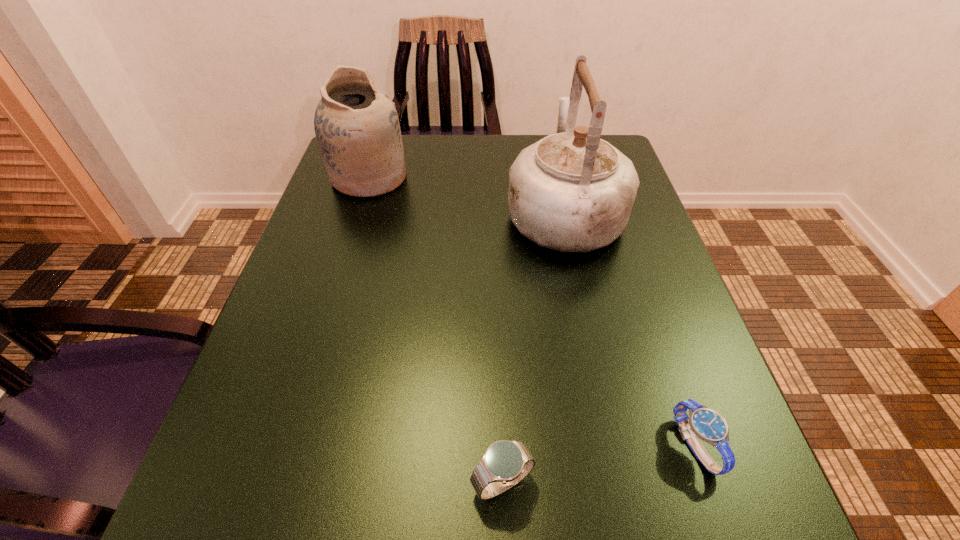
Where is `vacant space in between the kettle and the taller watch`? This screenshot has height=540, width=960. vacant space in between the kettle and the taller watch is located at coordinates (533, 347).

This screenshot has width=960, height=540. Identify the location of vacant point located between the taller watch and the leftmost object. (436, 330).

Identify the location of vacant area that lies between the taller watch and the tallest object. (533, 347).

Where is `free point between the shorter watch and the leftmost object`? This screenshot has width=960, height=540. free point between the shorter watch and the leftmost object is located at coordinates (532, 312).

The height and width of the screenshot is (540, 960). Identify the location of free space between the shorter watch and the taller watch. (598, 464).

Image resolution: width=960 pixels, height=540 pixels. Find the location of `free space that is in between the left watch and the pottery`. free space that is in between the left watch and the pottery is located at coordinates (436, 330).

You are a GUI agent. You are given a task and a screenshot of the screen. Output one action in this format:
    pyautogui.click(x=<x>, y=<y>)
    Task: Click on the third closest object to the pottery
    This screenshot has height=540, width=960.
    Given the screenshot: What is the action you would take?
    pyautogui.click(x=708, y=425)

The image size is (960, 540). What are the coordinates of `object that is the closest to the second tallest object` in the screenshot? It's located at (571, 191).

The image size is (960, 540). Find the location of `free region that satisfies the following two spatial constraints: 1. on the front side of the pottery; 2. on the right side of the second shortest object`. free region that satisfies the following two spatial constraints: 1. on the front side of the pottery; 2. on the right side of the second shortest object is located at coordinates (274, 483).